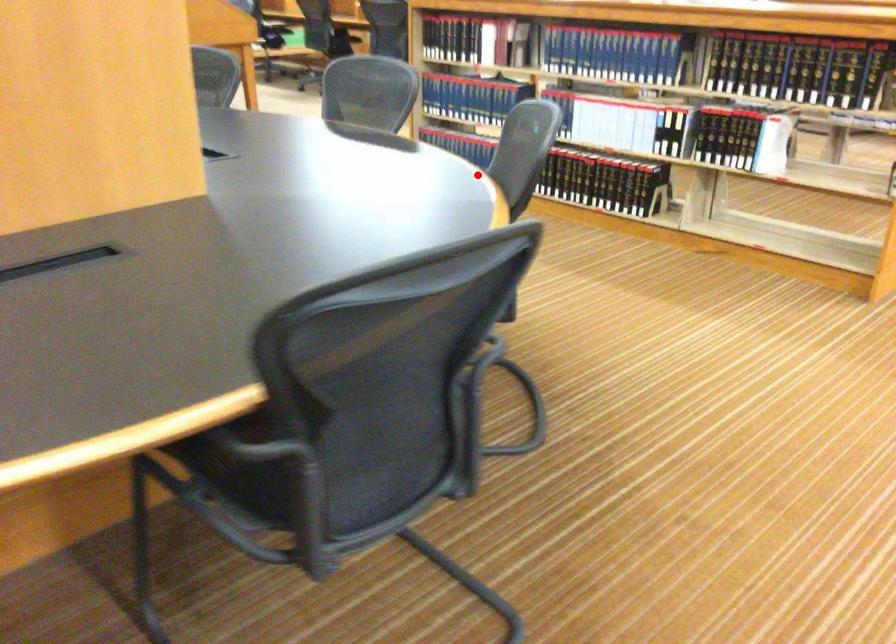
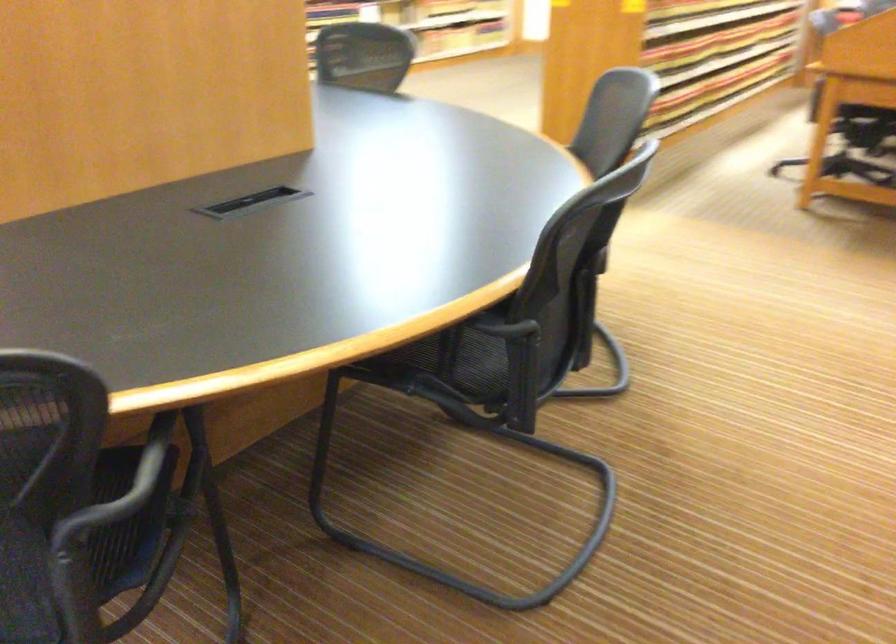
Locate, in the second image, the point that corresponds to the highlighted location in the first image.

(151, 460)